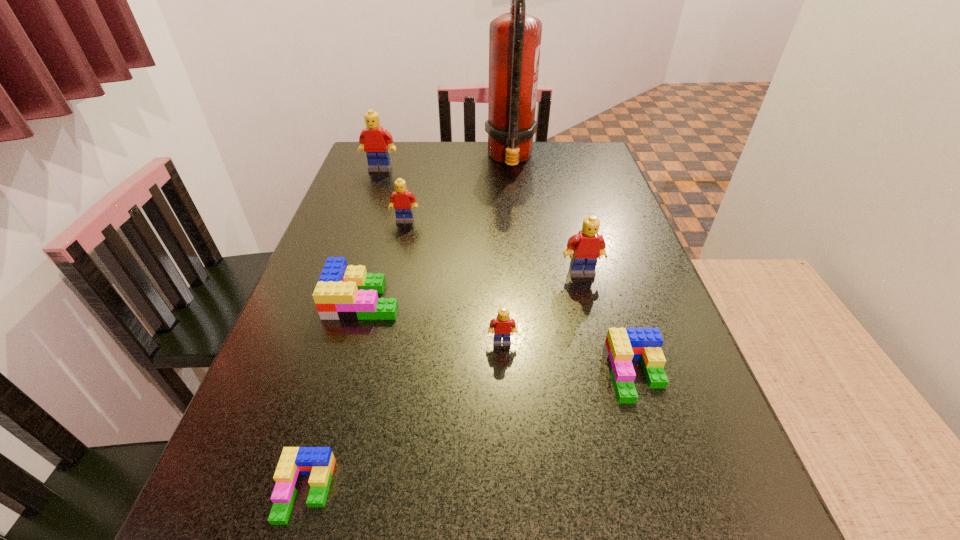
The width and height of the screenshot is (960, 540). In order to click on the fourth nearest Lego in this screenshot , I will do `click(343, 292)`.

At what (x,y) coordinates should I click in order to perform the action: click on the third shortest object. Please return your answer as a coordinate pair (x, y). Looking at the image, I should click on (343, 292).

The height and width of the screenshot is (540, 960). Identify the location of the second smallest green Lego. (622, 345).

The height and width of the screenshot is (540, 960). I want to click on the second shortest Lego, so click(622, 345).

Locate an element on the screen. The height and width of the screenshot is (540, 960). the nearest object is located at coordinates (318, 462).

Identify the location of the smallest green Lego. The height and width of the screenshot is (540, 960). (318, 462).

At what (x,y) coordinates should I click in order to perform the action: click on vacant space situated 0.260m at the nozzle of the tallest object. Please return your answer as a coordinate pair (x, y). This screenshot has height=540, width=960. Looking at the image, I should click on (402, 159).

Image resolution: width=960 pixels, height=540 pixels. Identify the location of free space located 0.210m at the nozzle of the tallest object. pos(419,159).

I want to click on free space located at the nozzle of the tallest object, so click(446, 159).

The image size is (960, 540). Find the location of `blank space located 0.140m on the front-facing side of the second tallest object`. blank space located 0.140m on the front-facing side of the second tallest object is located at coordinates (371, 197).